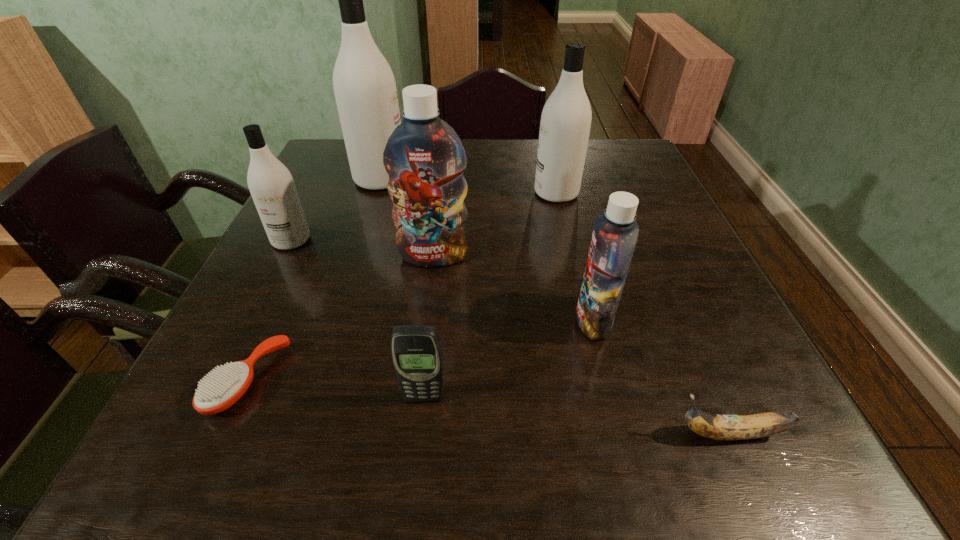
The height and width of the screenshot is (540, 960). I want to click on free spot that satisfies the following two spatial constraints: 1. on the front-facing side of the second white shampoo from left to right; 2. on the front side of the shortest object, so click(x=317, y=381).